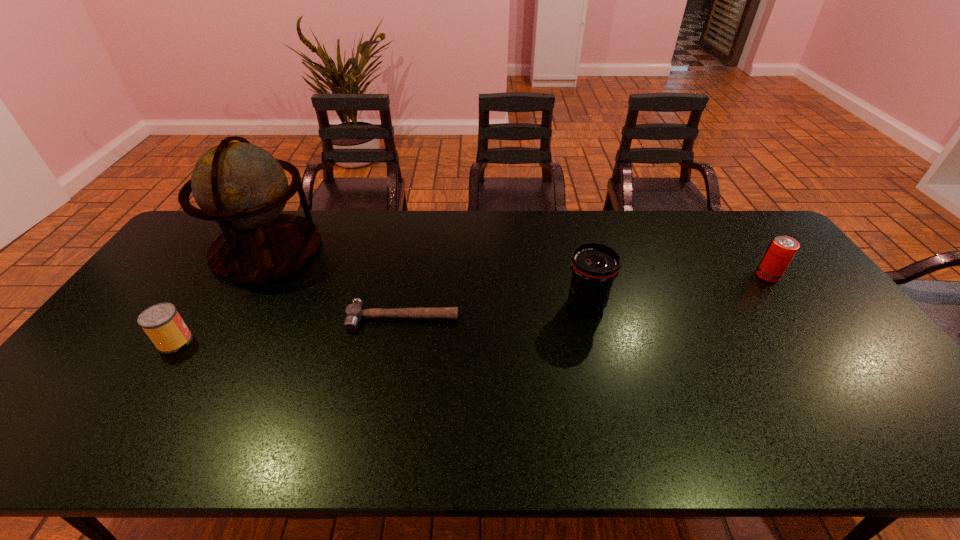
I want to click on the tallest object, so click(x=242, y=187).

Where is `telephoto lens`? Image resolution: width=960 pixels, height=540 pixels. telephoto lens is located at coordinates (594, 266).

Find the location of a particular element. Image resolution: width=960 pixels, height=540 pixels. the second tallest object is located at coordinates (594, 266).

Where is `the right can`? The image size is (960, 540). the right can is located at coordinates (781, 250).

Locate an element on the screen. The width and height of the screenshot is (960, 540). the rightmost object is located at coordinates (781, 250).

Find the location of `the left can`. the left can is located at coordinates (162, 323).

Where is `the shorter can`? the shorter can is located at coordinates (162, 323).

Where is `hammer`? The height and width of the screenshot is (540, 960). hammer is located at coordinates (354, 313).

You are a GUI agent. You are given a task and a screenshot of the screen. Output one action in this format:
    pyautogui.click(x=<x>, y=<y>)
    Task: Click on the third object from left to right
    
    Given the screenshot: What is the action you would take?
    click(x=354, y=313)

This screenshot has width=960, height=540. I want to click on blank area located on the front-facing side of the globe, so click(x=222, y=326).